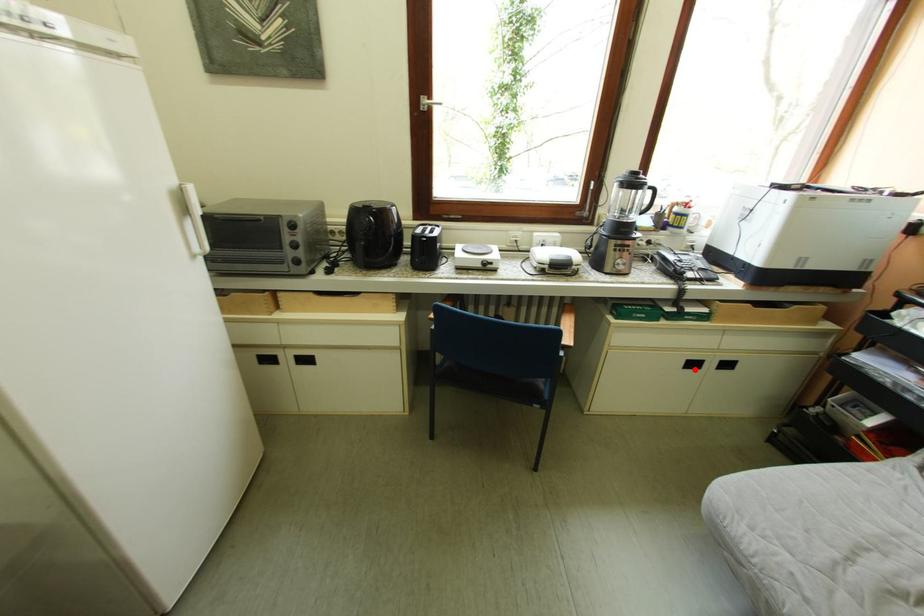
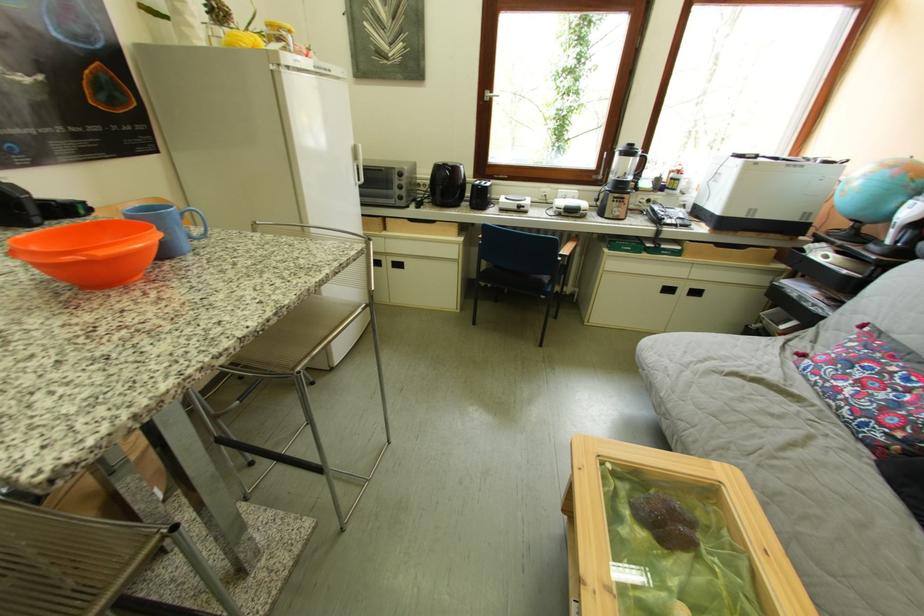
The point at the highlighted location is marked in the first image. Where is the corresponding point in the second image?

(672, 294)